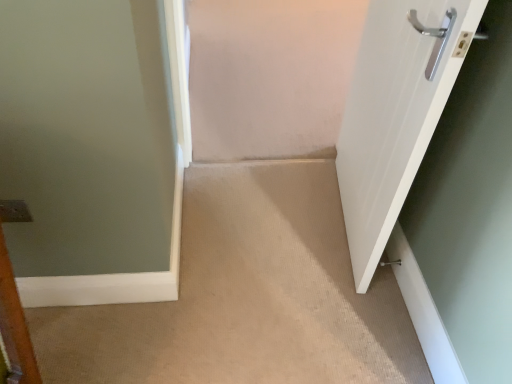
Question: Looking at the image, does beige carpet at center seem bigger or smaller compared to satin silver door handle at lower right?

Choices:
 (A) small
 (B) big

Answer: (B)

Question: In the image, is beige carpet at center positioned in front of or behind satin silver door handle at lower right?

Choices:
 (A) front
 (B) behind

Answer: (A)

Question: Which of these objects is positioned closest to the satin silver door handle at lower right?

Choices:
 (A) beige carpet at center
 (B) white glossy door at right

Answer: (A)

Question: Considering the real-world distances, which object is farthest from the satin silver door handle at lower right?

Choices:
 (A) beige carpet at center
 (B) white glossy door at right

Answer: (B)